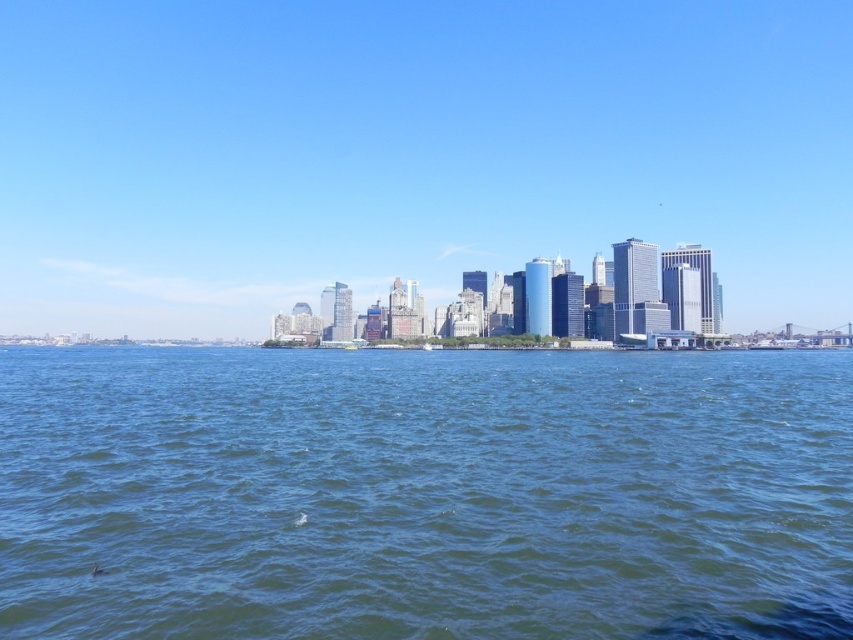
You are standing at the edge of the water in the city skyline view. You see two points marked in the image. Which point is closer to you, point (502,113) or point (42,596)?

Point (502,113) is further to the viewer than point (42,596), so point (42,596) is closer to you.

You are standing on a boat in the middle of the water and looking towards the city. Which object, the blue glass skyscrapers at center or the blue liquid water at center, is closer to your eyes?

The blue liquid water at center is closer to your eyes because it is below the blue glass skyscrapers at center, which are positioned above it.